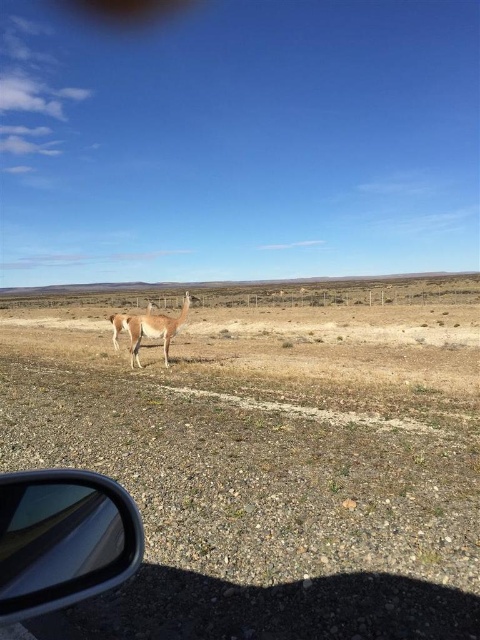
Question: Which object is farther from the camera taking this photo?

Choices:
 (A) fuzzy brown alpaca at center
 (B) light brown fur at center
 (C) transparent plastic side mirror at lower left

Answer: (A)

Question: Is transparent plastic side mirror at lower left wider than fuzzy brown alpaca at center?

Choices:
 (A) yes
 (B) no

Answer: (B)

Question: Which object is farther from the camera taking this photo?

Choices:
 (A) light brown fur at center
 (B) fuzzy brown alpaca at center
 (C) transparent plastic side mirror at lower left

Answer: (B)

Question: Which of the following is the farthest from the observer?

Choices:
 (A) light brown fur at center
 (B) fuzzy brown alpaca at center

Answer: (B)

Question: Is transparent plastic side mirror at lower left to the left of light brown fur at center from the viewer's perspective?

Choices:
 (A) no
 (B) yes

Answer: (A)

Question: Does transparent plastic side mirror at lower left have a larger size compared to light brown fur at center?

Choices:
 (A) no
 (B) yes

Answer: (A)